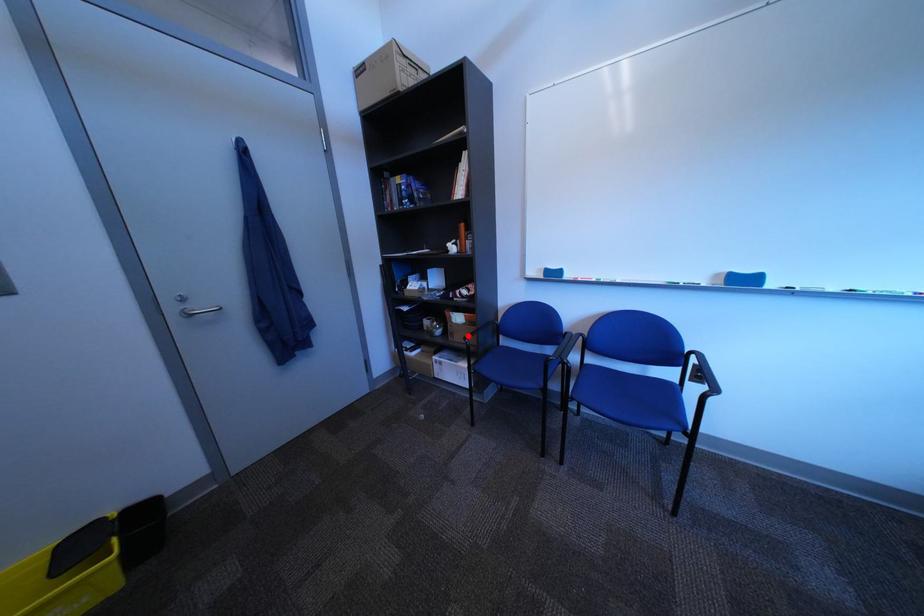
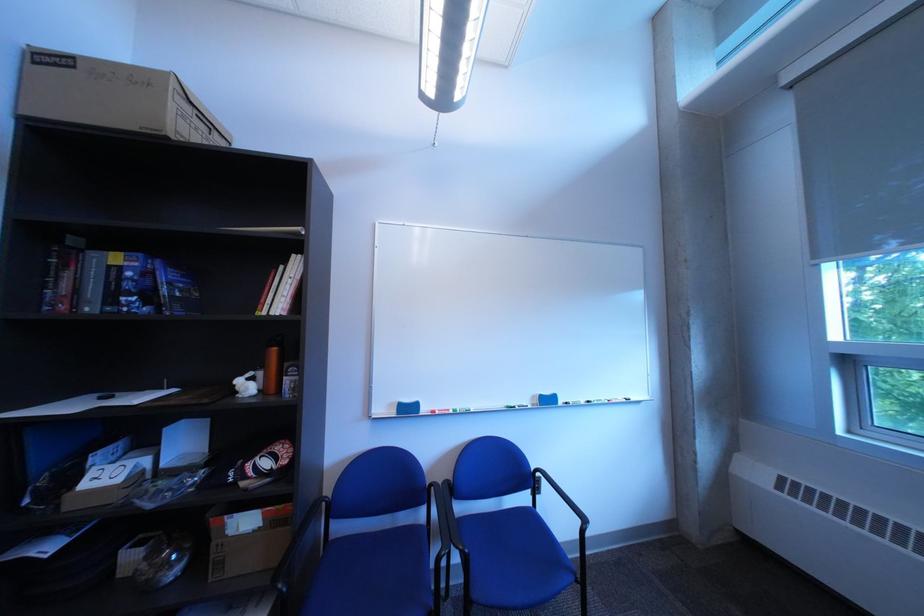
Question: A red point is marked in image1. In image2, is the corresponding 3D point closer to the camera or farther? Reply with the corresponding letter.

Choices:
 (A) The corresponding 3D point is closer.
 (B) The corresponding 3D point is farther.

Answer: (A)